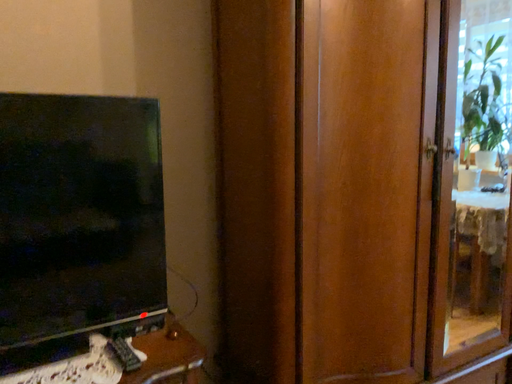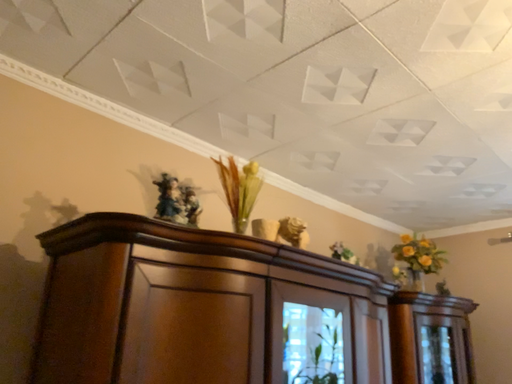
Question: How did the camera likely rotate when shooting the video?

Choices:
 (A) rotated downward
 (B) rotated upward

Answer: (B)